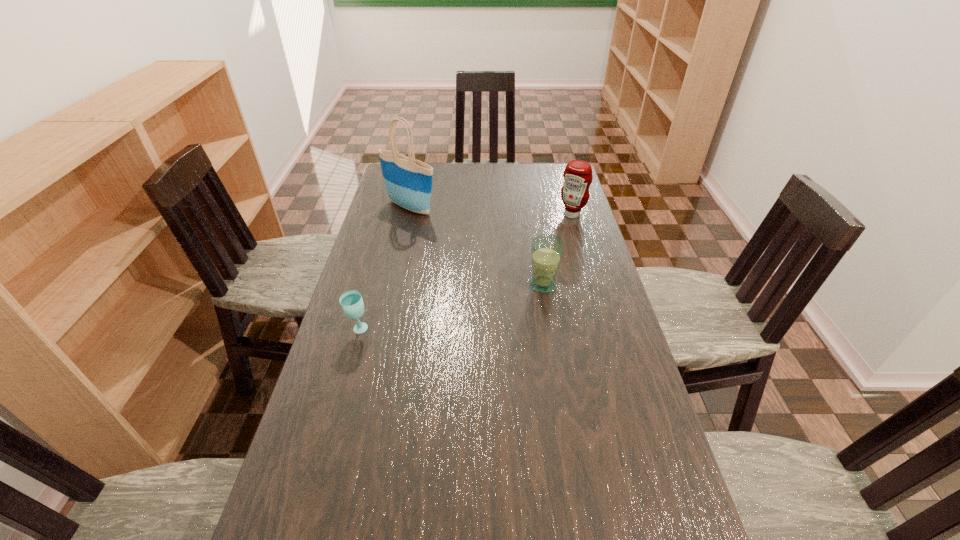
Identify the location of free space between the nearer glass and the second object from right to left. (450, 307).

Image resolution: width=960 pixels, height=540 pixels. I want to click on unoccupied area between the second shortest object and the shorter glass, so click(450, 307).

Image resolution: width=960 pixels, height=540 pixels. I want to click on free space between the shortest object and the rightmost object, so click(x=466, y=272).

Where is `free space between the tallest object and the third farthest object`? The width and height of the screenshot is (960, 540). free space between the tallest object and the third farthest object is located at coordinates (477, 246).

Locate which object is the third closest to the farther glass. Please provide its 2D coordinates. Your answer should be formatted as a tuple, i.e. [(x, y)], where the tuple contains the x and y coordinates of a point satisfying the conditions above.

[(351, 301)]

Image resolution: width=960 pixels, height=540 pixels. I want to click on object that is the closest to the third farthest object, so [577, 175].

Locate an element on the screen. This screenshot has height=540, width=960. vacant region that satisfies the following two spatial constraints: 1. on the back side of the second object from right to left; 2. on the right side of the third shortest object is located at coordinates (532, 214).

Image resolution: width=960 pixels, height=540 pixels. Find the location of `free space in the image that satisfies the following two spatial constraints: 1. on the back side of the third shortest object; 2. on the left side of the second shortest object`. free space in the image that satisfies the following two spatial constraints: 1. on the back side of the third shortest object; 2. on the left side of the second shortest object is located at coordinates (532, 214).

Where is `free region that satisfies the following two spatial constraints: 1. on the back side of the condiment; 2. on the left side of the third object from left to right`? The width and height of the screenshot is (960, 540). free region that satisfies the following two spatial constraints: 1. on the back side of the condiment; 2. on the left side of the third object from left to right is located at coordinates (532, 214).